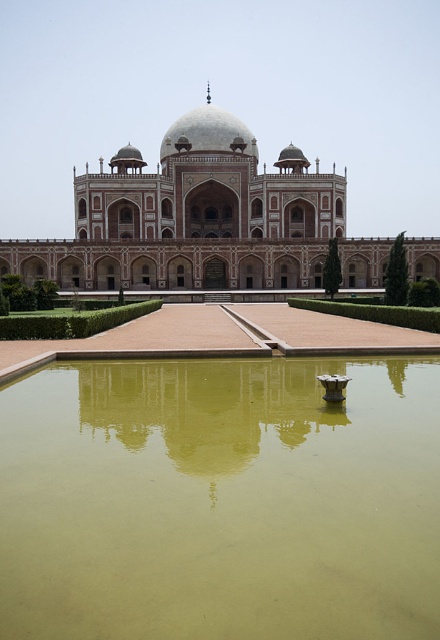
Question: Which point is farther to the camera?

Choices:
 (A) white marble palace at center
 (B) green murky water at center

Answer: (A)

Question: Does green murky water at center appear on the right side of white marble palace at center?

Choices:
 (A) yes
 (B) no

Answer: (A)

Question: Observing the image, what is the correct spatial positioning of green murky water at center in reference to white marble palace at center?

Choices:
 (A) right
 (B) left

Answer: (A)

Question: Is green murky water at center behind white marble palace at center?

Choices:
 (A) no
 (B) yes

Answer: (A)